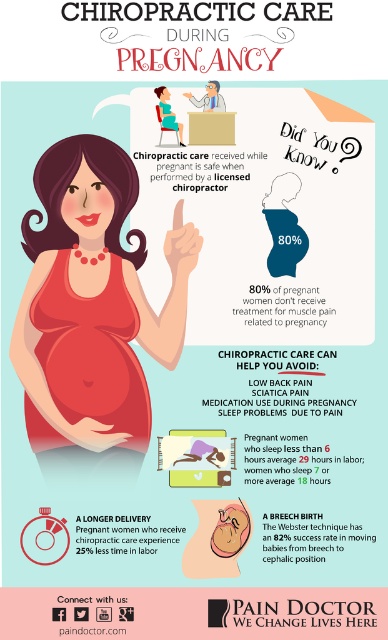
At what (x,y) coordinates should I click in order to perform the action: click on matte red dress at center. Please return your answer as a coordinate pair (x, y). Looking at the image, I should click on (93, 314).

In the scene shown: Which is above, matte red dress at center or matte red stomach at center?

matte red dress at center is above.

This screenshot has height=640, width=388. In order to click on matte red dress at center in this screenshot , I will do `click(93, 314)`.

Locate an element on the screen. matte red dress at center is located at coordinates (93, 314).